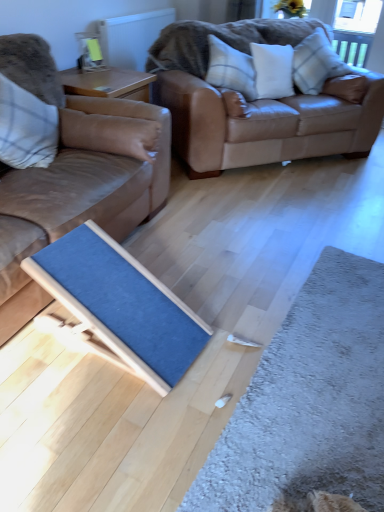
At what (x,y) coordinates should I click in order to perform the action: click on plaid fabric pillow at upper center, the second pillow positioned from the left. Please return your answer as a coordinate pair (x, y). Looking at the image, I should click on (231, 69).

Describe the element at coordinates (273, 70) in the screenshot. I see `white fabric pillow at upper center, the second pillow viewed from the right` at that location.

What do you see at coordinates (309, 401) in the screenshot? The image size is (384, 512). I see `blue fabric doormat at lower right, marked as the first doormat in a right-to-left arrangement` at bounding box center [309, 401].

The image size is (384, 512). In order to click on white textured radiator at upper center in this screenshot , I will do `click(131, 37)`.

What's the angular difference between white fabric pillow at upper center, the second pillow viewed from the right, and plaid fabric pillow at upper right, placed as the 1th pillow when sorted from right to left,'s facing directions?

white fabric pillow at upper center, the second pillow viewed from the right, and plaid fabric pillow at upper right, placed as the 1th pillow when sorted from right to left, are facing 0.000107 degrees away from each other.

Could you tell me if white fabric pillow at upper center, the second pillow viewed from the right, is turned towards plaid fabric pillow at upper right, which is the fourth pillow in left-to-right order?

No, white fabric pillow at upper center, the second pillow viewed from the right, is not oriented towards plaid fabric pillow at upper right, which is the fourth pillow in left-to-right order.

Is white fabric pillow at upper center, the third pillow from the left, in contact with plaid fabric pillow at upper right, which is the fourth pillow in left-to-right order?

No, white fabric pillow at upper center, the third pillow from the left, is not next to plaid fabric pillow at upper right, which is the fourth pillow in left-to-right order.

Is white fabric pillow at upper center, the third pillow from the left, directly adjacent to matte brown leather couch at left, positioned as the second studio couch in right-to-left order?

No, white fabric pillow at upper center, the third pillow from the left, is not making contact with matte brown leather couch at left, positioned as the second studio couch in right-to-left order.

Is white fabric pillow at upper center, the third pillow from the left, smaller than matte brown leather couch at left, which is the 1th studio couch in left-to-right order?

Correct, white fabric pillow at upper center, the third pillow from the left, occupies less space than matte brown leather couch at left, which is the 1th studio couch in left-to-right order.

Could matte brown leather couch at left, positioned as the second studio couch in right-to-left order, be considered to be inside white fabric pillow at upper center, the second pillow viewed from the right?

No.

Between point (275, 47) and point (27, 175), which one is positioned in front?

Point (27, 175)

Locate an element on the screen. This screenshot has height=512, width=384. studio couch that is the 1st object directly below the plaid fabric pillow at upper right, which is the fourth pillow in left-to-right order (from a real-world perspective) is located at coordinates (74, 175).

From a real-world perspective, is plaid fabric pillow at upper right, which is the fourth pillow in left-to-right order, under matte brown leather couch at left, positioned as the second studio couch in right-to-left order?

Actually, plaid fabric pillow at upper right, which is the fourth pillow in left-to-right order, is physically above matte brown leather couch at left, positioned as the second studio couch in right-to-left order, in the real world.

What's the angular difference between plaid fabric pillow at upper right, placed as the 1th pillow when sorted from right to left, and matte brown leather couch at left, which is the 1th studio couch in left-to-right order,'s facing directions?

The angle between the facing direction of plaid fabric pillow at upper right, placed as the 1th pillow when sorted from right to left, and the facing direction of matte brown leather couch at left, which is the 1th studio couch in left-to-right order, is 37.3 degrees.

Between plaid fabric pillow at upper right, which is the fourth pillow in left-to-right order, and matte brown leather couch at left, positioned as the second studio couch in right-to-left order, which one has larger width?

matte brown leather couch at left, positioned as the second studio couch in right-to-left order, is wider.

Considering the relative sizes of white fabric pillow at upper center, the second pillow viewed from the right, and blue fabric doormat at lower right, which ranks as the second doormat in left-to-right order, in the image provided, is white fabric pillow at upper center, the second pillow viewed from the right, smaller than blue fabric doormat at lower right, which ranks as the second doormat in left-to-right order,?

Incorrect, white fabric pillow at upper center, the second pillow viewed from the right, is not smaller in size than blue fabric doormat at lower right, which ranks as the second doormat in left-to-right order.

Is white fabric pillow at upper center, the second pillow viewed from the right, not near blue fabric doormat at lower right, which ranks as the second doormat in left-to-right order?

Yes, white fabric pillow at upper center, the second pillow viewed from the right, and blue fabric doormat at lower right, which ranks as the second doormat in left-to-right order, are located far from each other.

Between point (262, 67) and point (383, 307), which one is positioned in front?

The point (383, 307) is closer.

From a real-world perspective, between white fabric pillow at upper center, the second pillow viewed from the right, and blue fabric doormat at lower right, marked as the first doormat in a right-to-left arrangement, who is vertically lower?

blue fabric doormat at lower right, marked as the first doormat in a right-to-left arrangement, is physically lower.

Who is more distant, brown leather couch at upper center, placed as the 1th studio couch when sorted from right to left, or blue fabric doormat at lower right, marked as the first doormat in a right-to-left arrangement?

brown leather couch at upper center, placed as the 1th studio couch when sorted from right to left.

From a real-world perspective, is brown leather couch at upper center, which ranks as the 2th studio couch in left-to-right order, on top of blue fabric doormat at lower right, which ranks as the second doormat in left-to-right order?

Yes, from a real-world perspective, brown leather couch at upper center, which ranks as the 2th studio couch in left-to-right order, is above blue fabric doormat at lower right, which ranks as the second doormat in left-to-right order.

Is point (191, 34) closer to camera compared to point (286, 385)?

No, it is behind (286, 385).

Consider the image. Is plaid fabric pillow at left, which is the fourth pillow from right to left, facing away from blue fabric doormat at center, which is the first doormat from left to right?

plaid fabric pillow at left, which is the fourth pillow from right to left, does not have its back to blue fabric doormat at center, which is the first doormat from left to right.

How many degrees apart are the facing directions of plaid fabric pillow at left, acting as the first pillow starting from the left, and blue fabric doormat at center, which ranks as the second doormat in right-to-left order?

The angle between the facing direction of plaid fabric pillow at left, acting as the first pillow starting from the left, and the facing direction of blue fabric doormat at center, which ranks as the second doormat in right-to-left order, is 86.8 degrees.

Could blue fabric doormat at center, which is the first doormat from left to right, be considered to be inside plaid fabric pillow at left, acting as the first pillow starting from the left?

No, blue fabric doormat at center, which is the first doormat from left to right, is not a part of plaid fabric pillow at left, acting as the first pillow starting from the left.

Which is in front, point (174, 385) or point (112, 62)?

Point (174, 385)

Is blue fabric doormat at center, which ranks as the second doormat in right-to-left order, not within white textured radiator at upper center?

Yes, blue fabric doormat at center, which ranks as the second doormat in right-to-left order, is outside of white textured radiator at upper center.

Is blue fabric doormat at center, which ranks as the second doormat in right-to-left order, far from white textured radiator at upper center?

That's right, there is a large distance between blue fabric doormat at center, which ranks as the second doormat in right-to-left order, and white textured radiator at upper center.

This screenshot has width=384, height=512. Find the location of `the 1st pillow positioned below the plaid fabric pillow at upper right, which is the fourth pillow in left-to-right order (from the image's perspective)`. the 1st pillow positioned below the plaid fabric pillow at upper right, which is the fourth pillow in left-to-right order (from the image's perspective) is located at coordinates (273, 70).

From a real-world perspective, count 2nd pillows upward from the matte brown leather couch at left, positioned as the second studio couch in right-to-left order, and point to it. Please provide its 2D coordinates.

[(273, 70)]

Considering their positions, is plaid fabric pillow at upper right, which is the fourth pillow in left-to-right order, positioned closer to matte brown leather couch at left, which is the 1th studio couch in left-to-right order, than blue fabric doormat at center, which is the first doormat from left to right?

The object closer to matte brown leather couch at left, which is the 1th studio couch in left-to-right order, is blue fabric doormat at center, which is the first doormat from left to right.

Based on their spatial positions, is clear glass window screen at upper right or plaid fabric pillow at upper center, the second pillow positioned from the left, closer to blue fabric doormat at lower right, which ranks as the second doormat in left-to-right order?

Among the two, plaid fabric pillow at upper center, the second pillow positioned from the left, is located nearer to blue fabric doormat at lower right, which ranks as the second doormat in left-to-right order.

From the image, which object appears to be farther from plaid fabric pillow at upper right, which is the fourth pillow in left-to-right order, white fabric pillow at upper center, the second pillow viewed from the right, or clear glass window screen at upper right?

clear glass window screen at upper right lies further to plaid fabric pillow at upper right, which is the fourth pillow in left-to-right order, than the other object.

From the image, which object appears to be farther from plaid fabric pillow at left, acting as the first pillow starting from the left, white fabric pillow at upper center, the third pillow from the left, or blue fabric doormat at lower right, marked as the first doormat in a right-to-left arrangement?

Based on the image, white fabric pillow at upper center, the third pillow from the left, appears to be further to plaid fabric pillow at left, acting as the first pillow starting from the left.

When comparing their distances from blue fabric doormat at center, which is the first doormat from left to right, does plaid fabric pillow at upper center, the third pillow positioned from the right, or clear glass window screen at upper right seem closer?

plaid fabric pillow at upper center, the third pillow positioned from the right, is closer to blue fabric doormat at center, which is the first doormat from left to right.

Estimate the real-world distances between objects in this image. Which object is further from matte brown leather couch at left, positioned as the second studio couch in right-to-left order, brown leather couch at upper center, which ranks as the 2th studio couch in left-to-right order, or white fabric pillow at upper center, the third pillow from the left?

The object further to matte brown leather couch at left, positioned as the second studio couch in right-to-left order, is white fabric pillow at upper center, the third pillow from the left.

Based on the photo, considering their positions, is clear glass window screen at upper right positioned further to blue fabric doormat at center, which is the first doormat from left to right, than plaid fabric pillow at left, acting as the first pillow starting from the left?

clear glass window screen at upper right lies further to blue fabric doormat at center, which is the first doormat from left to right, than the other object.

Looking at this image, based on their spatial positions, is clear glass window screen at upper right or blue fabric doormat at lower right, marked as the first doormat in a right-to-left arrangement, closer to white fabric pillow at upper center, the third pillow from the left?

blue fabric doormat at lower right, marked as the first doormat in a right-to-left arrangement, lies closer to white fabric pillow at upper center, the third pillow from the left, than the other object.

The image size is (384, 512). Identify the location of pillow between plaid fabric pillow at upper center, the third pillow positioned from the right, and blue fabric doormat at lower right, marked as the first doormat in a right-to-left arrangement, vertically. (108, 132).

Where is `radiator between plaid fabric pillow at left, which is the fourth pillow from right to left, and white fabric pillow at upper center, the second pillow viewed from the right, in the horizontal direction`? radiator between plaid fabric pillow at left, which is the fourth pillow from right to left, and white fabric pillow at upper center, the second pillow viewed from the right, in the horizontal direction is located at coordinates (131, 37).

Where is `radiator that lies between clear glass window screen at upper right and blue fabric doormat at center, which ranks as the second doormat in right-to-left order, from top to bottom`? radiator that lies between clear glass window screen at upper right and blue fabric doormat at center, which ranks as the second doormat in right-to-left order, from top to bottom is located at coordinates (131, 37).

Where is `pillow positioned between brown leather couch at upper center, placed as the 1th studio couch when sorted from right to left, and white fabric pillow at upper center, the third pillow from the left, from near to far`? Image resolution: width=384 pixels, height=512 pixels. pillow positioned between brown leather couch at upper center, placed as the 1th studio couch when sorted from right to left, and white fabric pillow at upper center, the third pillow from the left, from near to far is located at coordinates (231, 69).